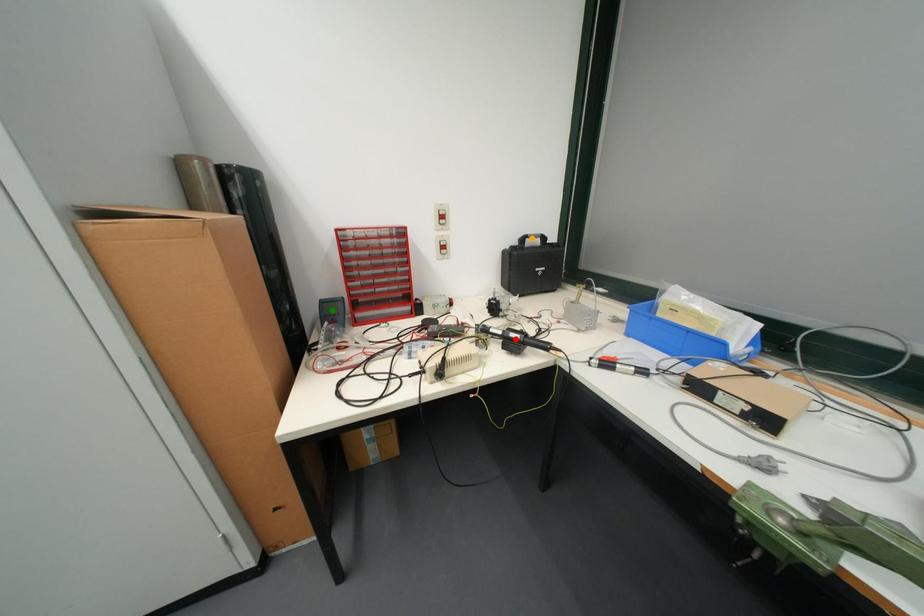
Order these from nearest to farthest:
A) green point
B) orange point
C) red point

→ red point → green point → orange point